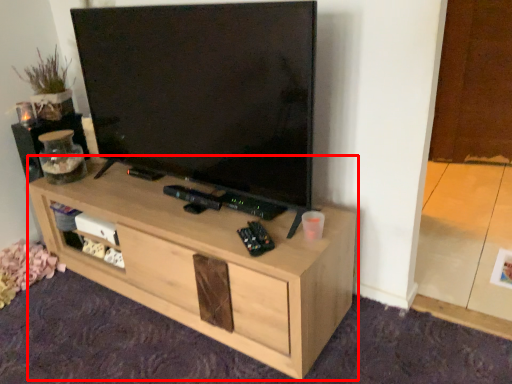
Question: From the image's perspective, where is desk (annotated by the red box) located relative to speaker?

Choices:
 (A) above
 (B) below

Answer: (B)